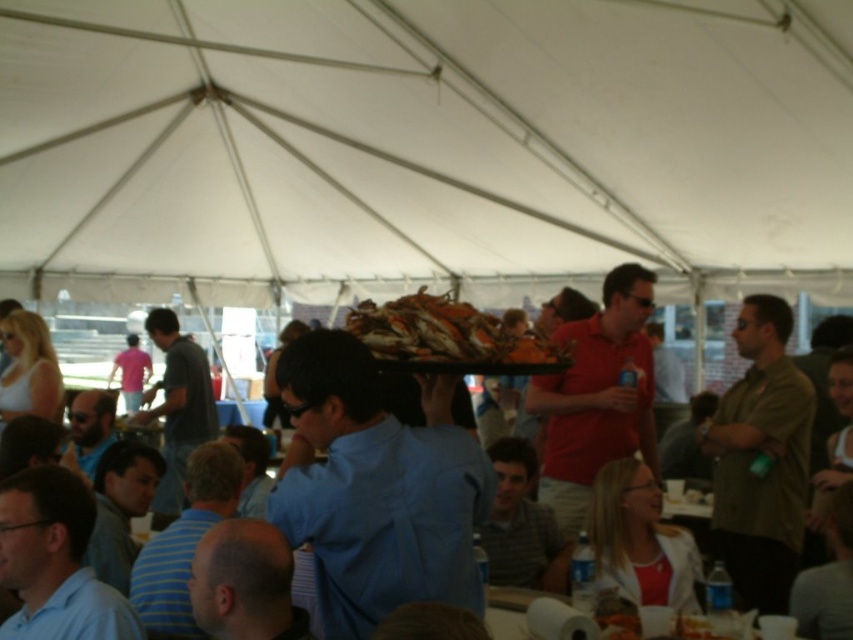
Question: Is green matte shirt at center bigger than orange shellfish at center?

Choices:
 (A) no
 (B) yes

Answer: (B)

Question: Is green matte shirt at center positioned at the back of orange shellfish at center?

Choices:
 (A) yes
 (B) no

Answer: (A)

Question: Is green matte shirt at center behind orange shellfish at center?

Choices:
 (A) no
 (B) yes

Answer: (B)

Question: Which point is closer to the camera?

Choices:
 (A) (514, 352)
 (B) (758, 392)

Answer: (A)